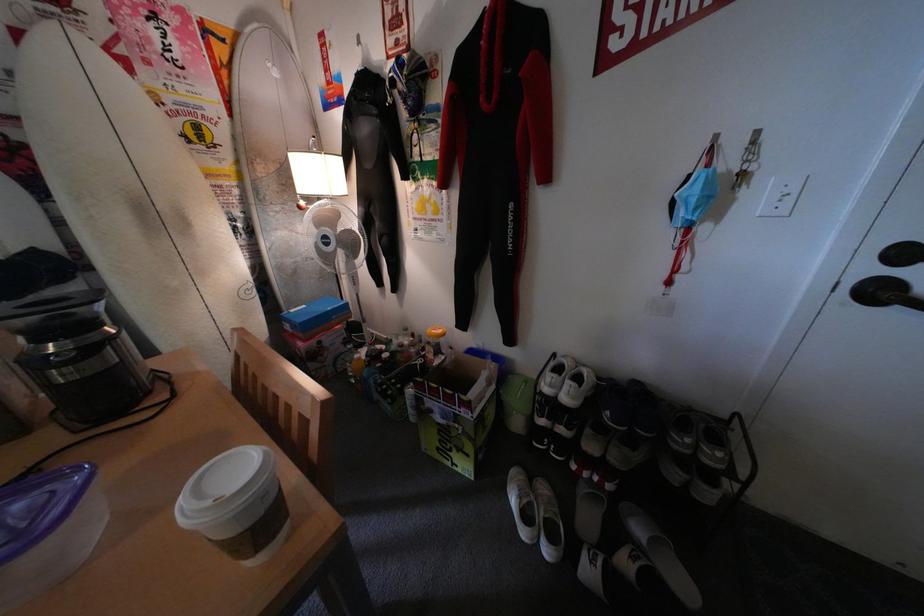
Where is `plastic food container`? This screenshot has width=924, height=616. plastic food container is located at coordinates (49, 511).